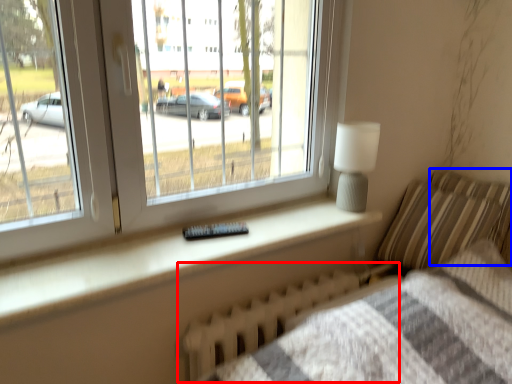
Question: Which object appears farthest to the camera in this image, radiator (highlighted by a red box) or pillow (highlighted by a blue box)?

Choices:
 (A) radiator
 (B) pillow

Answer: (B)